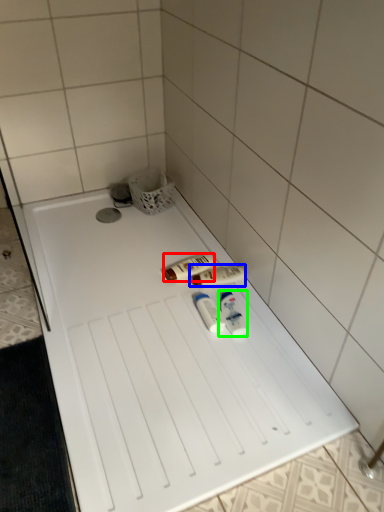
Question: Which is farther away from toiletry (highlighted by a red box)? toiletry (highlighted by a blue box) or toiletry (highlighted by a green box)?

Choices:
 (A) toiletry
 (B) toiletry

Answer: (B)